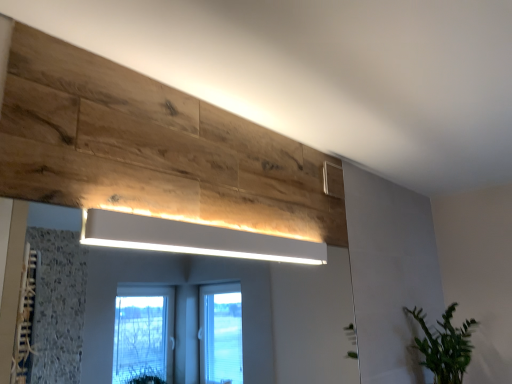
Question: Is green leafy plant at lower right oriented away from white matte rectangular light fixture at upper center?

Choices:
 (A) no
 (B) yes

Answer: (A)

Question: Is green leafy plant at lower right positioned before white matte rectangular light fixture at upper center?

Choices:
 (A) no
 (B) yes

Answer: (A)

Question: Is the position of green leafy plant at lower right more distant than that of white matte rectangular light fixture at upper center?

Choices:
 (A) no
 (B) yes

Answer: (B)

Question: Is green leafy plant at lower right at the right side of white matte rectangular light fixture at upper center?

Choices:
 (A) no
 (B) yes

Answer: (B)

Question: From the image's perspective, is green leafy plant at lower right under white matte rectangular light fixture at upper center?

Choices:
 (A) yes
 (B) no

Answer: (A)

Question: Is green leafy plant at lower right bigger than white matte rectangular light fixture at upper center?

Choices:
 (A) yes
 (B) no

Answer: (A)

Question: Is green leafy plant at lower right a part of white matte rectangular light fixture at upper center?

Choices:
 (A) yes
 (B) no

Answer: (B)

Question: Is white matte rectangular light fixture at upper center aimed at green leafy plant at lower right?

Choices:
 (A) no
 (B) yes

Answer: (A)

Question: Is there a large distance between white matte rectangular light fixture at upper center and green leafy plant at lower right?

Choices:
 (A) no
 (B) yes

Answer: (B)

Question: From the image's perspective, is white matte rectangular light fixture at upper center below green leafy plant at lower right?

Choices:
 (A) no
 (B) yes

Answer: (A)

Question: Is white matte rectangular light fixture at upper center to the left of green leafy plant at lower right from the viewer's perspective?

Choices:
 (A) yes
 (B) no

Answer: (A)

Question: From a real-world perspective, is white matte rectangular light fixture at upper center beneath green leafy plant at lower right?

Choices:
 (A) yes
 (B) no

Answer: (B)

Question: Based on their sizes in the image, would you say white matte rectangular light fixture at upper center is bigger or smaller than green leafy plant at lower right?

Choices:
 (A) small
 (B) big

Answer: (A)